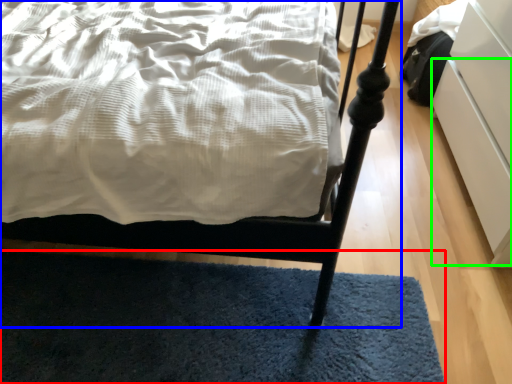
Question: Estimate the real-world distances between objects in this image. Which object is farther from mat (highlighted by a red box), bed (highlighted by a blue box) or drawer (highlighted by a green box)?

Choices:
 (A) bed
 (B) drawer

Answer: (B)